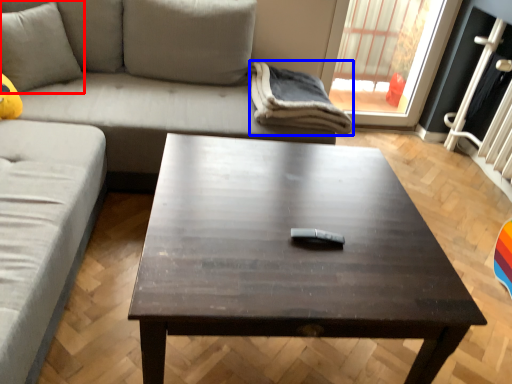
Question: Among these objects, which one is farthest to the camera, pillow (highlighted by a red box) or blanket (highlighted by a blue box)?

Choices:
 (A) pillow
 (B) blanket

Answer: (B)